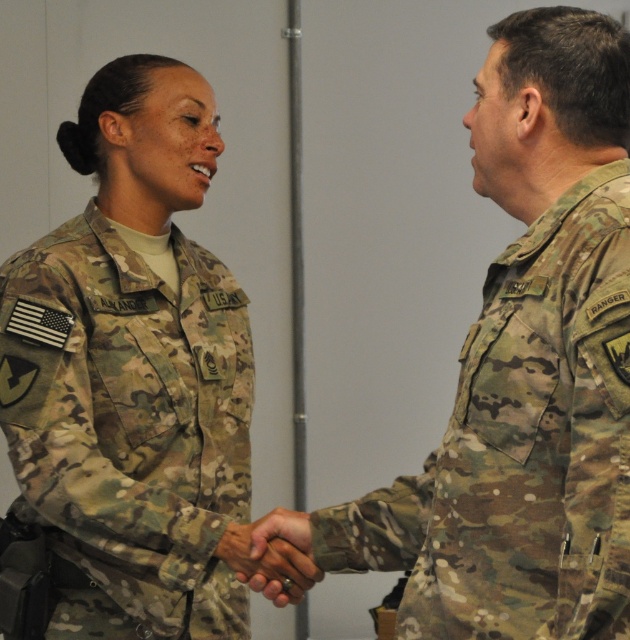
Question: Is camouflage uniform at right further to camera compared to camouflage fabric hand at center?

Choices:
 (A) no
 (B) yes

Answer: (A)

Question: Among these points, which one is nearest to the camera?

Choices:
 (A) (186, 433)
 (B) (423, 465)

Answer: (B)

Question: Can you confirm if camouflage uniform at right is thinner than camouflage fabric hand at center?

Choices:
 (A) yes
 (B) no

Answer: (B)

Question: Which is nearer to the camouflage fabric hand at center?

Choices:
 (A) camouflage uniform at right
 (B) camouflage fabric uniform at center

Answer: (B)

Question: Among these objects, which one is farthest from the camera?

Choices:
 (A) camouflage uniform at right
 (B) camouflage fabric hand at center

Answer: (B)

Question: Is camouflage uniform at right positioned at the back of camouflage fabric hand at center?

Choices:
 (A) no
 (B) yes

Answer: (A)